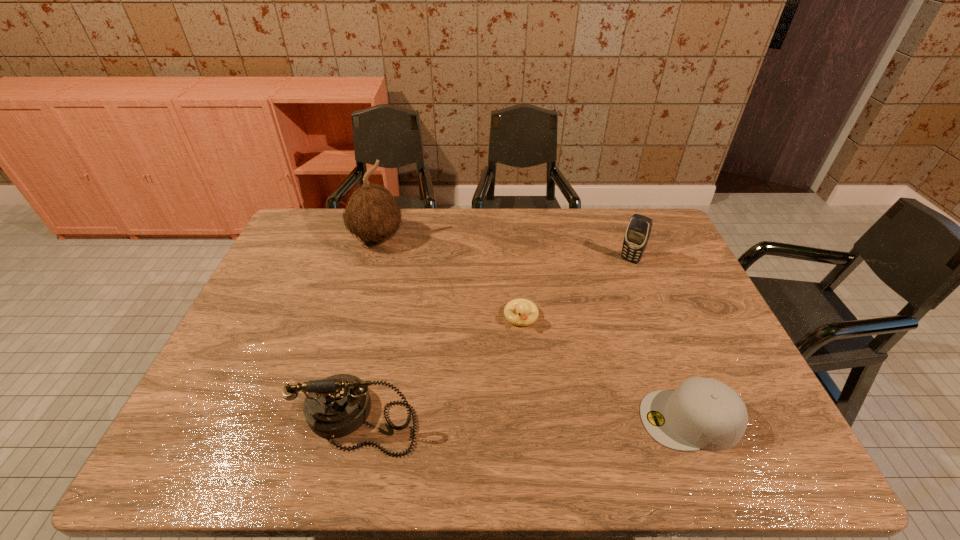
Find the location of a particular element. Image resolution: width=960 pixels, height=540 pixels. free space on the desktop that is between the telephone and the cap and is positioned at the beak of the third object from right to left is located at coordinates (539, 418).

Find the location of a particular element. Image resolution: width=960 pixels, height=540 pixels. free space on the desktop that is between the telephone and the fourth tallest object and is positioned on the surface of the tallest object is located at coordinates (526, 418).

Find the location of a particular element. The width and height of the screenshot is (960, 540). vacant spot on the desktop that is between the telephone and the second shortest object and is positioned on the front face of the cellular telephone is located at coordinates 516,418.